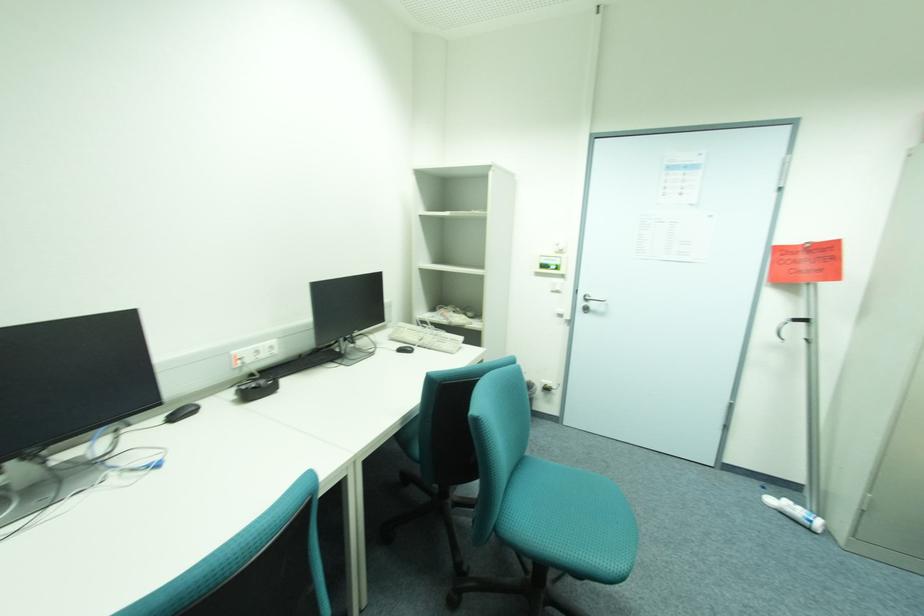
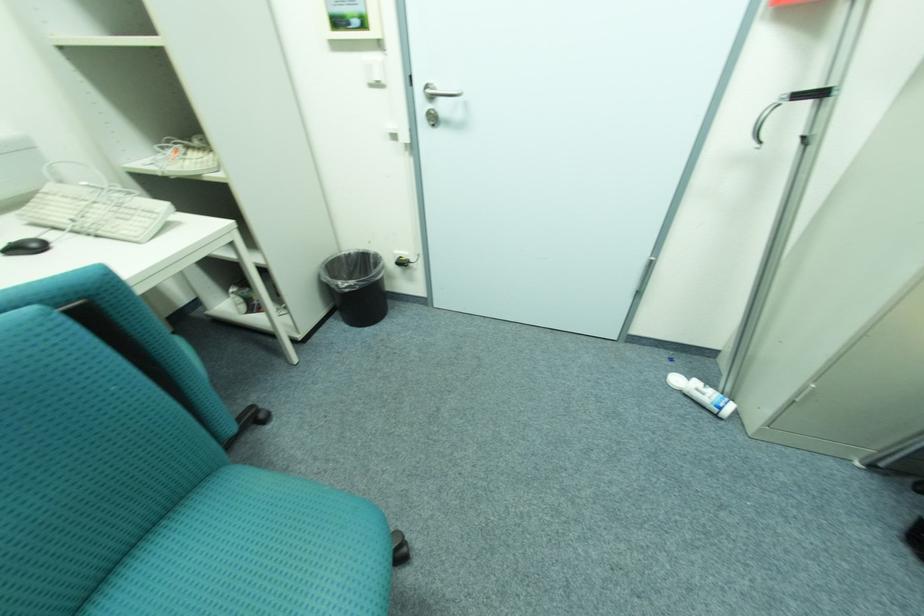
Locate, in the second image, the point that corresponds to (776,501) in the first image.

(683, 381)